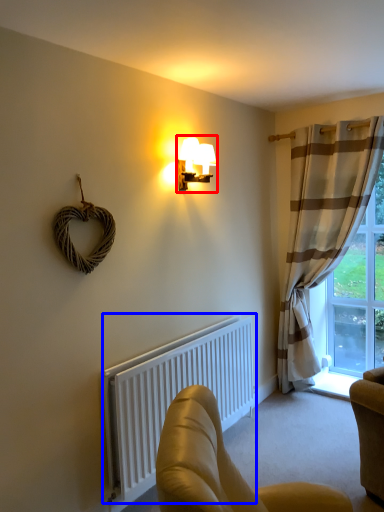
Question: Which of the following is the closest to the observer, lamp (highlighted by a red box) or radiator (highlighted by a blue box)?

Choices:
 (A) lamp
 (B) radiator

Answer: (B)